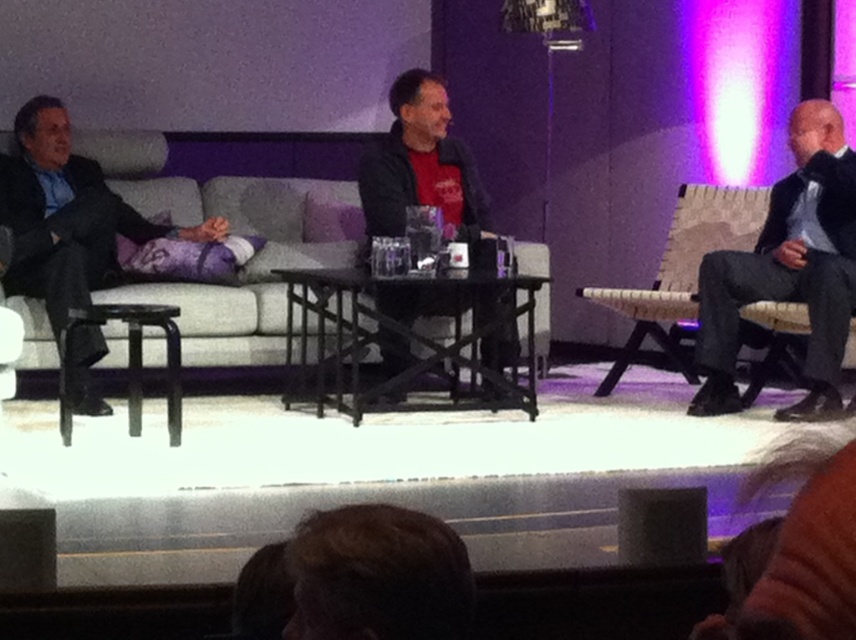
Does dark gray suit at right have a lesser height compared to black matte jacket at center?

No, dark gray suit at right is not shorter than black matte jacket at center.

Which is above, dark gray suit at right or black matte jacket at center?

black matte jacket at center

Locate an element on the screen. This screenshot has width=856, height=640. dark gray suit at right is located at coordinates (788, 269).

Find the location of a particular element. The image size is (856, 640). dark gray suit at right is located at coordinates (788, 269).

Does dark gray suit at right have a larger size compared to woven fabric chair at right?

No, dark gray suit at right is not bigger than woven fabric chair at right.

Which is in front, point (708, 387) or point (667, 248)?

Point (708, 387) is more forward.

Which is in front, point (735, 292) or point (752, 396)?

Point (735, 292)

You are a GUI agent. You are given a task and a screenshot of the screen. Output one action in this format:
    pyautogui.click(x=<x>, y=<y>)
    Task: Click on the dark gray suit at right
    
    Given the screenshot: What is the action you would take?
    pyautogui.click(x=788, y=269)

Who is positioned more to the left, dark gray suit at left or woven fabric chair at right?

dark gray suit at left

Identify the location of dark gray suit at left. (67, 216).